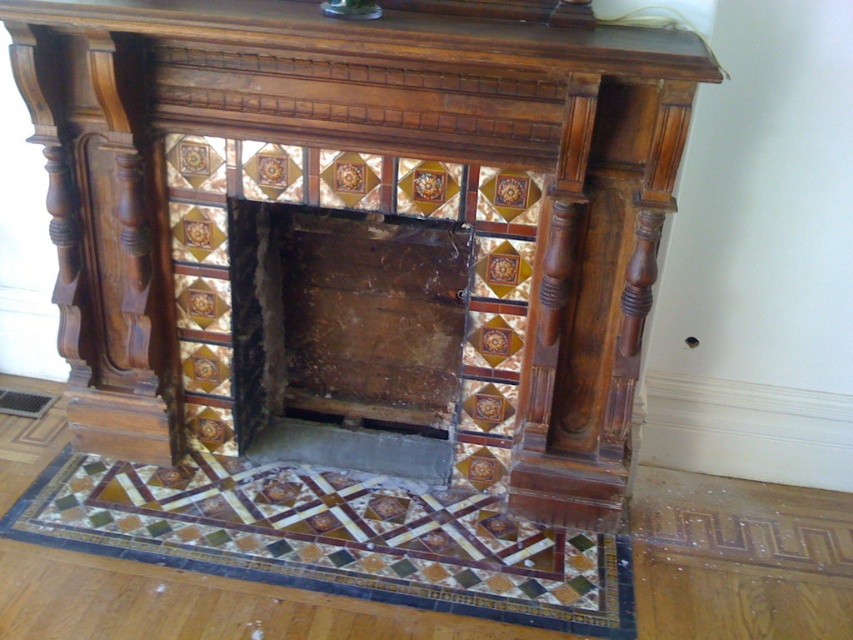
Question: Which point is closer to the camera?

Choices:
 (A) (280, 243)
 (B) (303, 74)
 (C) (503, 26)
 (D) (305, 582)

Answer: (C)

Question: Based on their relative distances, which object is nearer to the polished wood fireplace at center?

Choices:
 (A) rusty wood fireplace at center
 (B) mosaic tile floor at lower center

Answer: (A)

Question: Does polished wood fireplace at center appear on the left side of rusty wood fireplace at center?

Choices:
 (A) no
 (B) yes

Answer: (A)

Question: Estimate the real-world distances between objects in this image. Which object is farther from the rusty wood fireplace at center?

Choices:
 (A) polished wood fireplace at center
 (B) polished wood mantle at upper center
 (C) mosaic tile floor at lower center

Answer: (B)

Question: Does polished wood fireplace at center appear over polished wood mantle at upper center?

Choices:
 (A) no
 (B) yes

Answer: (A)

Question: Is polished wood fireplace at center thinner than polished wood mantle at upper center?

Choices:
 (A) yes
 (B) no

Answer: (B)